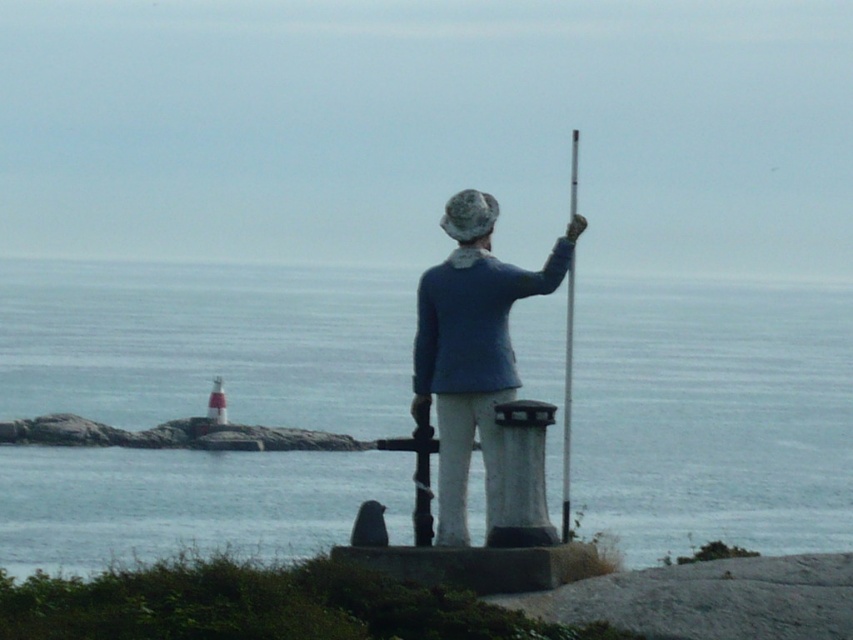
Is point (288, 280) more distant than point (570, 321)?

Yes.

Which is in front, point (244, 333) or point (570, 314)?

Point (570, 314) is in front.

Locate an element on the screen. Image resolution: width=853 pixels, height=640 pixels. blue water at center is located at coordinates (712, 416).

Does blue water at center have a smaller size compared to blue fabric jacket at center?

No, blue water at center is not smaller than blue fabric jacket at center.

Is blue water at center behind blue fabric jacket at center?

No, it is not.

Is point (746, 412) positioned after point (451, 259)?

Yes, point (746, 412) is behind point (451, 259).

At what (x,y) coordinates should I click in order to perform the action: click on blue water at center. Please return your answer as a coordinate pair (x, y). Looking at the image, I should click on click(x=712, y=416).

Does point (434, 403) lie in front of point (567, 280)?

Yes, it is.

Which is more to the right, blue fabric jacket at center or metallic pole at center?

metallic pole at center

Between point (579, 227) and point (569, 410), which one is positioned behind?

The point (579, 227) is more distant.

Locate an element on the screen. The height and width of the screenshot is (640, 853). blue fabric jacket at center is located at coordinates (473, 349).